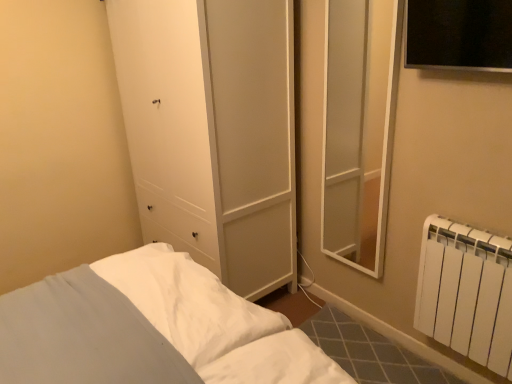
Question: Is white soft pillow at lower left taller or shorter than white matte radiator at lower right?

Choices:
 (A) tall
 (B) short

Answer: (A)

Question: Considering the positions of point (0, 375) and point (466, 228), is point (0, 375) closer or farther from the camera than point (466, 228)?

Choices:
 (A) farther
 (B) closer

Answer: (B)

Question: From the image's perspective, is white soft pillow at lower left above or below white matte radiator at lower right?

Choices:
 (A) above
 (B) below

Answer: (B)

Question: In terms of height, does white matte radiator at lower right look taller or shorter compared to white soft pillow at lower left?

Choices:
 (A) tall
 (B) short

Answer: (B)

Question: Choose the correct answer: Is white matte radiator at lower right inside white soft pillow at lower left or outside it?

Choices:
 (A) inside
 (B) outside

Answer: (B)

Question: Is white matte radiator at lower right in front of or behind white soft pillow at lower left in the image?

Choices:
 (A) behind
 (B) front

Answer: (A)

Question: From the image's perspective, is white matte radiator at lower right above or below white soft pillow at lower left?

Choices:
 (A) above
 (B) below

Answer: (A)